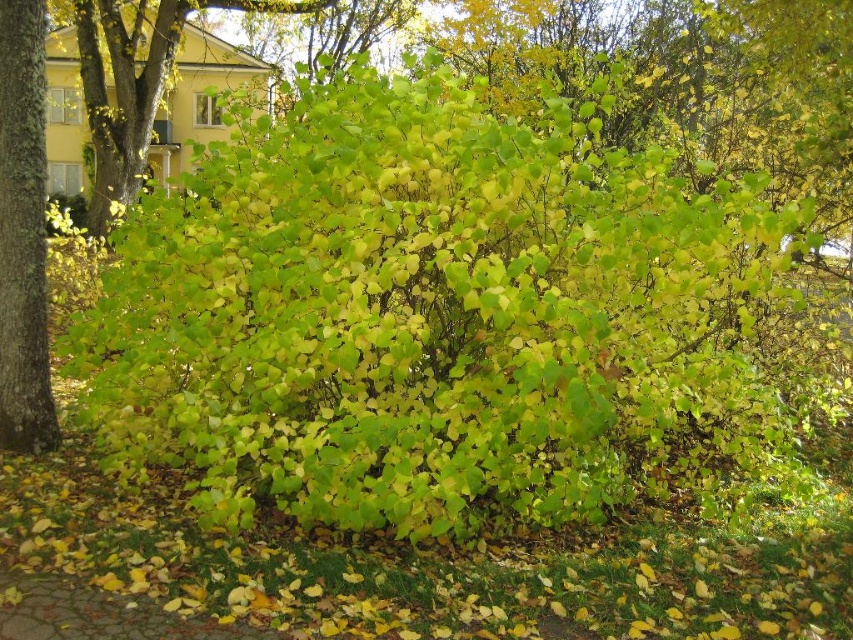
Who is higher up, green leafy bush at center or green leafy bush at upper center?

Positioned higher is green leafy bush at upper center.

Between green leafy bush at center and green leafy bush at upper center, which one has less height?

Standing shorter between the two is green leafy bush at center.

Does point (608, 456) come in front of point (90, 211)?

Yes, it is in front of point (90, 211).

Locate an element on the screen. Image resolution: width=853 pixels, height=640 pixels. green leafy bush at center is located at coordinates (440, 320).

You are a GUI agent. You are given a task and a screenshot of the screen. Output one action in this format:
    pyautogui.click(x=<x>, y=<y>)
    Task: Click on the green rough bark tree at left
    The image size is (853, 640).
    Given the screenshot: What is the action you would take?
    (22, 230)

Is point (10, 332) positioned in front of point (33, 596)?

No, it is behind (33, 596).

This screenshot has height=640, width=853. What do you see at coordinates (22, 230) in the screenshot? I see `green rough bark tree at left` at bounding box center [22, 230].

Locate an element on the screen. The width and height of the screenshot is (853, 640). green rough bark tree at left is located at coordinates (22, 230).

Is point (10, 362) positioned behind point (138, 104)?

No, (10, 362) is closer to viewer.

This screenshot has height=640, width=853. Describe the element at coordinates (22, 230) in the screenshot. I see `green rough bark tree at left` at that location.

You are a GUI agent. You are given a task and a screenshot of the screen. Output one action in this format:
    pyautogui.click(x=<x>, y=<y>)
    Task: Click on the green rough bark tree at left
    
    Given the screenshot: What is the action you would take?
    22,230